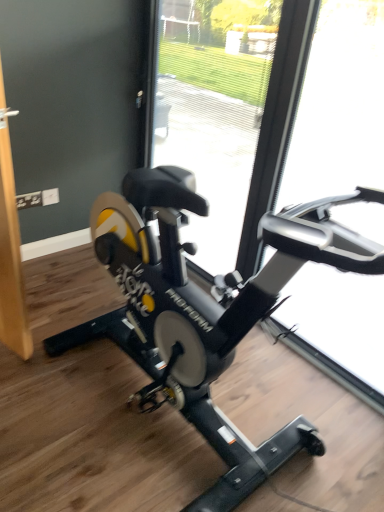
This screenshot has width=384, height=512. Identify the location of transparent glass door at right, which appears as the first glass door when viewed from the right. (339, 106).

Locate an element on the screen. black matte stationary bicycle at center is located at coordinates (205, 310).

Image resolution: width=384 pixels, height=512 pixels. Describe the element at coordinates (213, 110) in the screenshot. I see `transparent glass door at center, which is the 2th glass door in right-to-left order` at that location.

The image size is (384, 512). In order to click on transparent glass door at right, which appears as the first glass door when viewed from the right in this screenshot , I will do `click(339, 106)`.

In the scene shown: Is black matte stationary bicycle at center turned away from transparent glass door at right, which appears as the first glass door when viewed from the right?

No, transparent glass door at right, which appears as the first glass door when viewed from the right, is not at the back of black matte stationary bicycle at center.

What's the angular difference between black matte stationary bicycle at center and transparent glass door at right, which is the second glass door from left to right,'s facing directions?

The facing directions of black matte stationary bicycle at center and transparent glass door at right, which is the second glass door from left to right, are 90.5 degrees apart.

Which is in front, point (203, 300) or point (375, 89)?

The point (203, 300) is closer to the camera.

Find the location of a particular element. stationary bicycle on the left of transparent glass door at right, which is the second glass door from left to right is located at coordinates (205, 310).

Is transparent glass door at right, which appears as the first glass door when viewed from the right, oriented towards transparent glass door at center, which ranks as the 1th glass door in left-to-right order?

No, transparent glass door at right, which appears as the first glass door when viewed from the right, is not oriented towards transparent glass door at center, which ranks as the 1th glass door in left-to-right order.

Consider the image. From the image's perspective, which one is positioned higher, transparent glass door at right, which appears as the first glass door when viewed from the right, or transparent glass door at center, which ranks as the 1th glass door in left-to-right order?

transparent glass door at center, which ranks as the 1th glass door in left-to-right order, appears higher in the image.

In terms of size, does transparent glass door at right, which is the second glass door from left to right, appear bigger or smaller than transparent glass door at center, which is the 2th glass door in right-to-left order?

Considering their sizes, transparent glass door at right, which is the second glass door from left to right, takes up less space than transparent glass door at center, which is the 2th glass door in right-to-left order.

Is transparent glass door at right, which appears as the first glass door when viewed from the right, taller or shorter than transparent glass door at center, which ranks as the 1th glass door in left-to-right order?

transparent glass door at right, which appears as the first glass door when viewed from the right, is taller than transparent glass door at center, which ranks as the 1th glass door in left-to-right order.

Who is bigger, transparent glass door at right, which appears as the first glass door when viewed from the right, or black matte stationary bicycle at center?

Bigger between the two is black matte stationary bicycle at center.

Looking at this image, from a real-world perspective, does transparent glass door at right, which is the second glass door from left to right, stand above black matte stationary bicycle at center?

Yes, from a real-world perspective, transparent glass door at right, which is the second glass door from left to right, is on top of black matte stationary bicycle at center.

Which object is thinner, transparent glass door at right, which appears as the first glass door when viewed from the right, or black matte stationary bicycle at center?

With smaller width is transparent glass door at right, which appears as the first glass door when viewed from the right.

Based on the photo, is black matte stationary bicycle at center at the back of transparent glass door at right, which is the second glass door from left to right?

No, transparent glass door at right, which is the second glass door from left to right,'s orientation is not away from black matte stationary bicycle at center.

Considering the relative positions of transparent glass door at center, which ranks as the 1th glass door in left-to-right order, and transparent glass door at right, which is the second glass door from left to right, in the image provided, is transparent glass door at center, which ranks as the 1th glass door in left-to-right order, behind transparent glass door at right, which is the second glass door from left to right,?

Yes, transparent glass door at center, which ranks as the 1th glass door in left-to-right order, is further from the camera.

From a real-world perspective, does transparent glass door at center, which ranks as the 1th glass door in left-to-right order, sit lower than transparent glass door at right, which is the second glass door from left to right?

Indeed, from a real-world perspective, transparent glass door at center, which ranks as the 1th glass door in left-to-right order, is positioned beneath transparent glass door at right, which is the second glass door from left to right.

Is transparent glass door at center, which ranks as the 1th glass door in left-to-right order, bigger or smaller than transparent glass door at right, which is the second glass door from left to right?

In the image, transparent glass door at center, which ranks as the 1th glass door in left-to-right order, appears to be larger than transparent glass door at right, which is the second glass door from left to right.

Which object is wider, black matte stationary bicycle at center or transparent glass door at center, which is the 2th glass door in right-to-left order?

black matte stationary bicycle at center.

From a real-world perspective, is black matte stationary bicycle at center positioned over transparent glass door at center, which is the 2th glass door in right-to-left order, based on gravity?

No, from a real-world perspective, black matte stationary bicycle at center is not above transparent glass door at center, which is the 2th glass door in right-to-left order.

Considering the relative sizes of black matte stationary bicycle at center and transparent glass door at center, which ranks as the 1th glass door in left-to-right order, in the image provided, is black matte stationary bicycle at center smaller than transparent glass door at center, which ranks as the 1th glass door in left-to-right order,?

Yes.

Find the location of a particular element. The width and height of the screenshot is (384, 512). stationary bicycle directly beneath the transparent glass door at center, which is the 2th glass door in right-to-left order (from a real-world perspective) is located at coordinates (205, 310).

Does transparent glass door at center, which is the 2th glass door in right-to-left order, have a greater width compared to black matte stationary bicycle at center?

No, transparent glass door at center, which is the 2th glass door in right-to-left order, is not wider than black matte stationary bicycle at center.

Relative to black matte stationary bicycle at center, is transparent glass door at center, which ranks as the 1th glass door in left-to-right order, in front or behind?

In the image, transparent glass door at center, which ranks as the 1th glass door in left-to-right order, appears behind black matte stationary bicycle at center.

Would you consider transparent glass door at center, which ranks as the 1th glass door in left-to-right order, to be distant from black matte stationary bicycle at center?

No, transparent glass door at center, which ranks as the 1th glass door in left-to-right order, is not far from black matte stationary bicycle at center.

Would you say transparent glass door at center, which ranks as the 1th glass door in left-to-right order, is outside black matte stationary bicycle at center?

transparent glass door at center, which ranks as the 1th glass door in left-to-right order, is positioned outside black matte stationary bicycle at center.

Find the location of a particular element. stationary bicycle located in front of the transparent glass door at right, which is the second glass door from left to right is located at coordinates (205, 310).

At what (x,y) coordinates should I click in order to perform the action: click on glass door that appears above the transparent glass door at right, which is the second glass door from left to right (from the image's perspective). Please return your answer as a coordinate pair (x, y). This screenshot has height=512, width=384. Looking at the image, I should click on (213, 110).

From the image, which object appears to be nearer to black matte stationary bicycle at center, transparent glass door at center, which ranks as the 1th glass door in left-to-right order, or transparent glass door at right, which appears as the first glass door when viewed from the right?

transparent glass door at right, which appears as the first glass door when viewed from the right, is closer to black matte stationary bicycle at center.

Which object lies further to the anchor point transparent glass door at center, which is the 2th glass door in right-to-left order, transparent glass door at right, which is the second glass door from left to right, or black matte stationary bicycle at center?

Among the two, black matte stationary bicycle at center is located further to transparent glass door at center, which is the 2th glass door in right-to-left order.

Looking at the image, which one is located further to transparent glass door at right, which is the second glass door from left to right, transparent glass door at center, which ranks as the 1th glass door in left-to-right order, or black matte stationary bicycle at center?

Based on the image, black matte stationary bicycle at center appears to be further to transparent glass door at right, which is the second glass door from left to right.

Based on the photo, when comparing their distances from black matte stationary bicycle at center, does transparent glass door at right, which appears as the first glass door when viewed from the right, or transparent glass door at center, which is the 2th glass door in right-to-left order, seem further?

The object further to black matte stationary bicycle at center is transparent glass door at center, which is the 2th glass door in right-to-left order.

Based on their spatial positions, is black matte stationary bicycle at center or transparent glass door at center, which ranks as the 1th glass door in left-to-right order, further from transparent glass door at right, which appears as the first glass door when viewed from the right?

black matte stationary bicycle at center is further to transparent glass door at right, which appears as the first glass door when viewed from the right.

When comparing their distances from transparent glass door at center, which is the 2th glass door in right-to-left order, does black matte stationary bicycle at center or transparent glass door at right, which is the second glass door from left to right, seem closer?

Based on the image, transparent glass door at right, which is the second glass door from left to right, appears to be nearer to transparent glass door at center, which is the 2th glass door in right-to-left order.

Where is `glass door between transparent glass door at center, which ranks as the 1th glass door in left-to-right order, and black matte stationary bicycle at center vertically`? Image resolution: width=384 pixels, height=512 pixels. glass door between transparent glass door at center, which ranks as the 1th glass door in left-to-right order, and black matte stationary bicycle at center vertically is located at coordinates (339, 106).